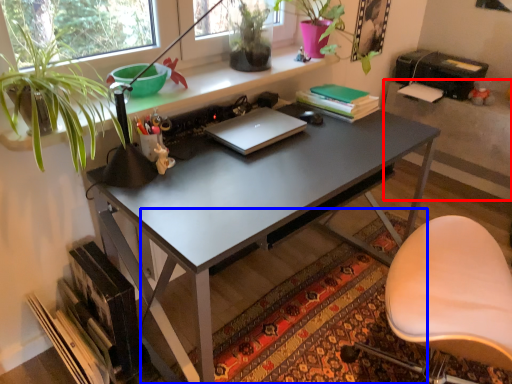
Question: Which of the following is the closest to the observer, table (highlighted by a red box) or mat (highlighted by a blue box)?

Choices:
 (A) table
 (B) mat

Answer: (B)